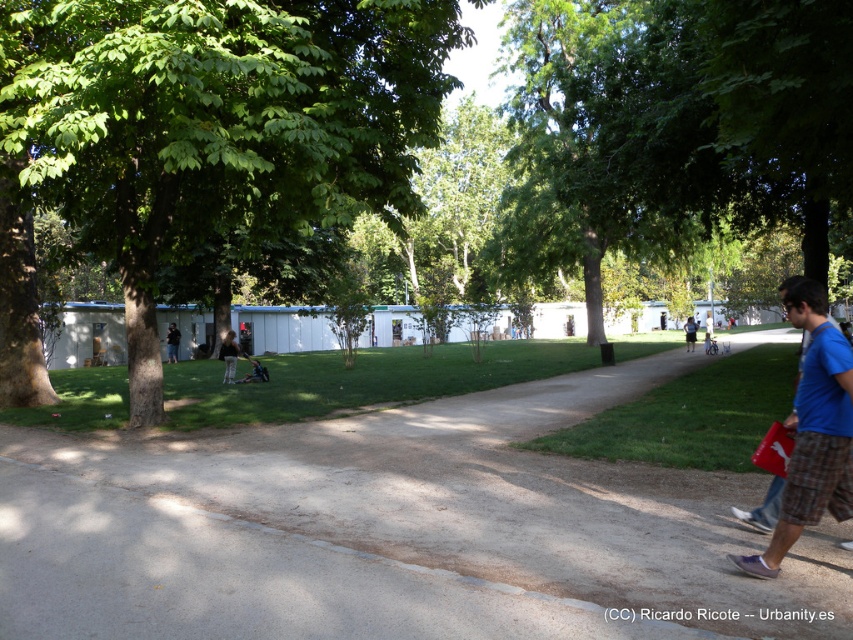
You are standing at the origin point in the park and want to walk to the gray concrete pavement at center. According to the coordinate system where the bottom left corner is the origin, what direction should you move in to reach it?

The gray concrete pavement at center is located at coordinate point (393, 531). Since the origin is at the bottom left corner, moving towards the right and slightly upwards will reach the gray concrete pavement at center.

You are standing on the paved pathway in the park and see both the green leafy tree at center and the light brown leather jacket at center. Which object is closer to you?

The green leafy tree at center is closer to the viewer than the light brown leather jacket at center.

You are a photographer planning to take a photo of the green leafy tree at center and the dark blue jeans at lower left. Which object appears taller in the photo?

The green leafy tree at center is taller than the dark blue jeans at lower left.